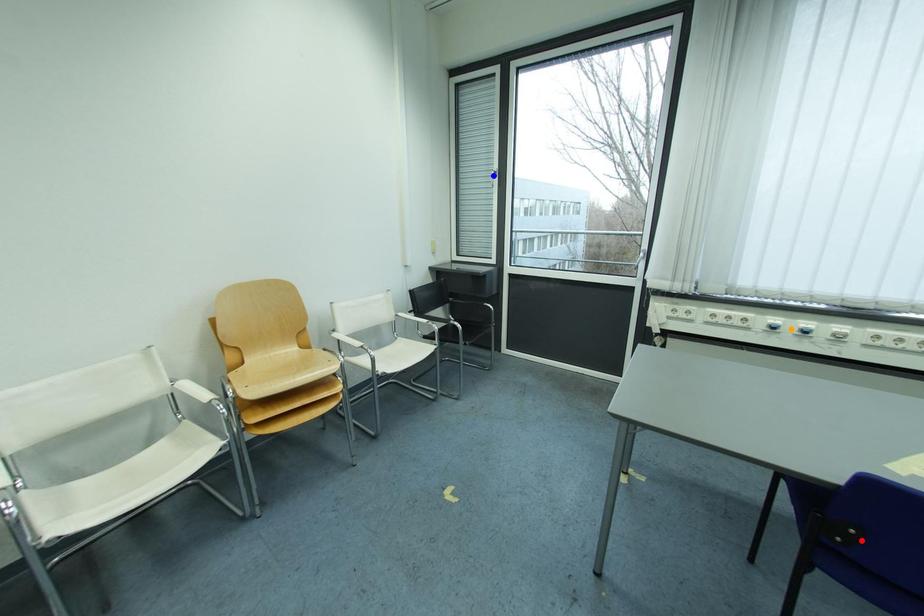
Order these from nearest to farthest:
A) blue point
B) orange point
C) red point

1. red point
2. orange point
3. blue point